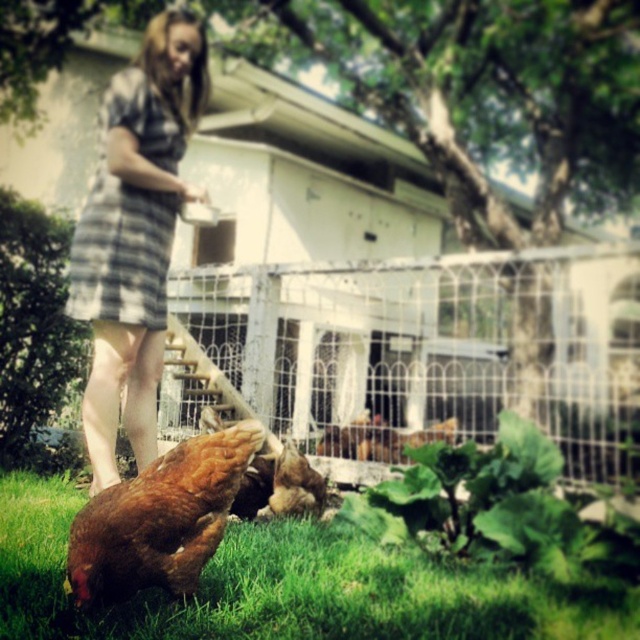
Question: Which of these objects is positioned farthest from the green grass at lower left?

Choices:
 (A) brown feathered chicken at lower left
 (B) wire mesh fence at center
 (C) plaid fabric dress at center

Answer: (B)

Question: Is green grass at lower left thinner than brown feathered chicken at center?

Choices:
 (A) yes
 (B) no

Answer: (B)

Question: Can you confirm if brown feathered chicken at lower left is thinner than brown feathered chicken at center?

Choices:
 (A) yes
 (B) no

Answer: (B)

Question: Can you confirm if plaid fabric dress at center is positioned below brown feathered chicken at center?

Choices:
 (A) no
 (B) yes

Answer: (A)

Question: Among these objects, which one is nearest to the camera?

Choices:
 (A) green grass at lower left
 (B) wire mesh fence at center
 (C) brown feathered chicken at lower left
 (D) plaid fabric dress at center

Answer: (A)

Question: Which point is farther from the camera taking this photo?

Choices:
 (A) (97, 502)
 (B) (573, 620)
 (C) (304, 497)

Answer: (C)